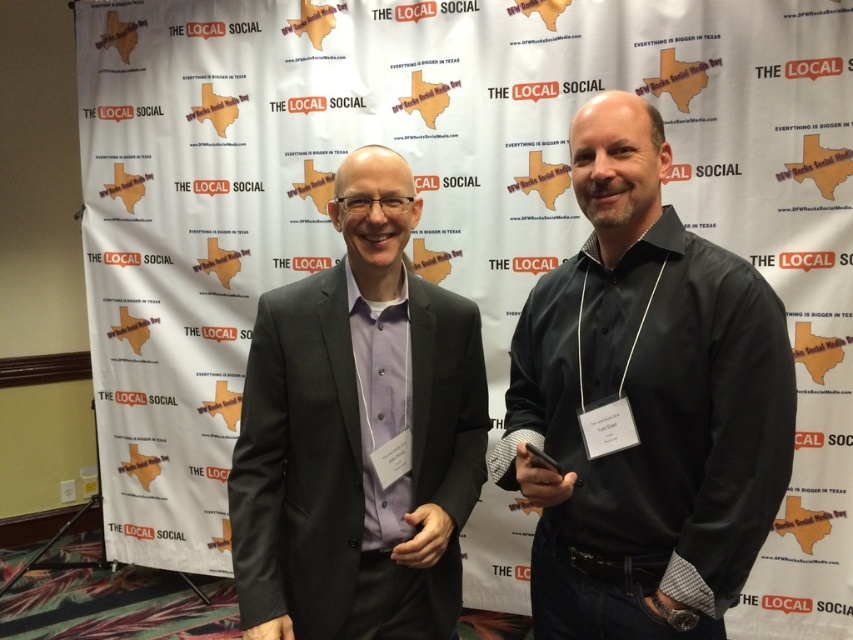
You are a photographer positioned at the center of the scene. You need to focus your camera on the black matte shirt at right. Based on the coordinates provided, what are the exact coordinates where you should aim your camera lens?

The exact coordinates to aim the camera lens are at point (x=643, y=404), as the black matte shirt at right is located there.